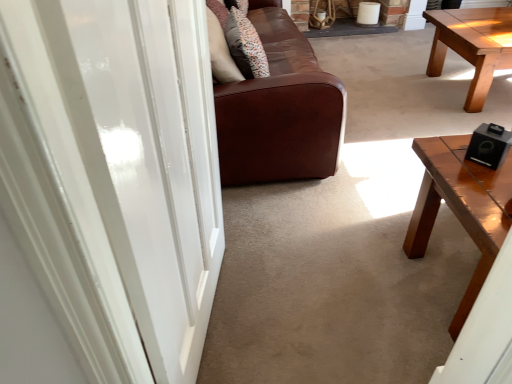
Where is `vacant space to the right of brown leather couch at center`? The width and height of the screenshot is (512, 384). vacant space to the right of brown leather couch at center is located at coordinates (403, 97).